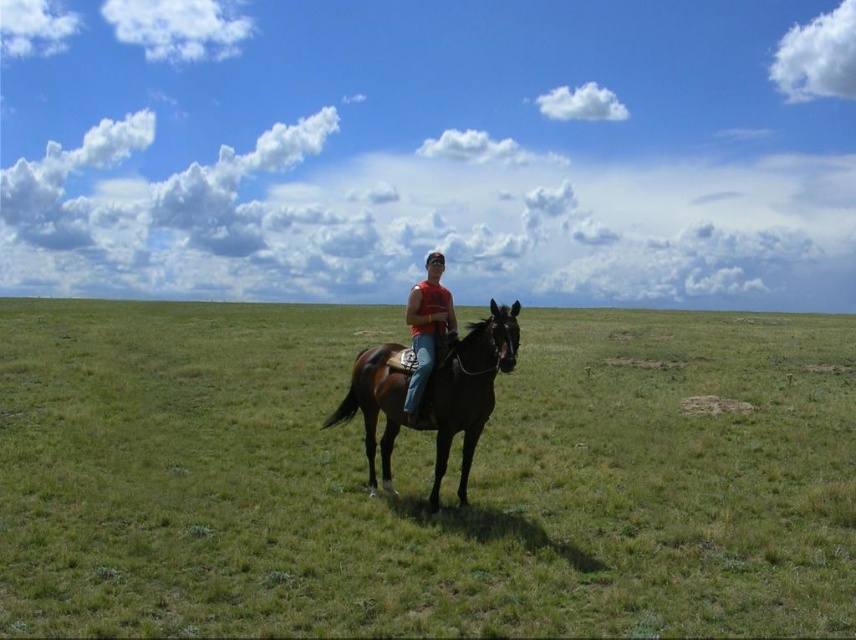
Question: Which object is closer to the camera taking this photo?

Choices:
 (A) matte red tank top at center
 (B) green grassy field at center

Answer: (B)

Question: Does shiny brown horse at center have a smaller size compared to matte red tank top at center?

Choices:
 (A) yes
 (B) no

Answer: (B)

Question: Can you confirm if green grassy field at center is bigger than matte red tank top at center?

Choices:
 (A) yes
 (B) no

Answer: (A)

Question: Is the position of green grassy field at center less distant than that of shiny brown horse at center?

Choices:
 (A) yes
 (B) no

Answer: (A)

Question: Which of the following is the farthest from the observer?

Choices:
 (A) matte red tank top at center
 (B) green grassy field at center

Answer: (A)

Question: Which is farther from the matte red tank top at center?

Choices:
 (A) green grassy field at center
 (B) shiny brown horse at center

Answer: (A)